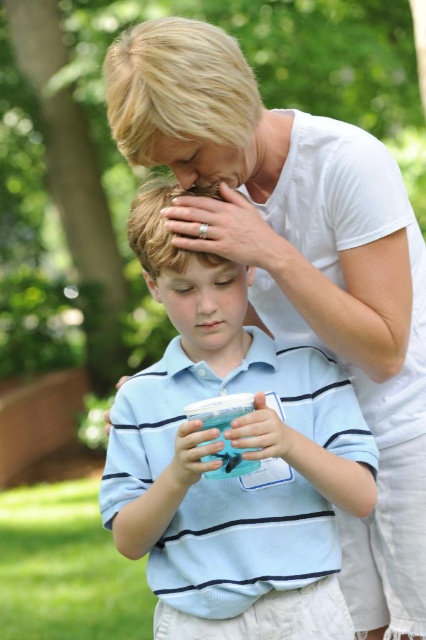
Measure the distance from translucent plastic cup at center to matte plastic cup at lower center.

They are 23.17 inches apart.

Does point (178, 458) come in front of point (123, 378)?

Yes, it is in front of point (123, 378).

Locate an element on the screen. This screenshot has height=640, width=426. translucent plastic cup at center is located at coordinates (192, 454).

The height and width of the screenshot is (640, 426). Identify the location of translucent plastic cup at center. (192, 454).

This screenshot has height=640, width=426. What do you see at coordinates (232, 468) in the screenshot?
I see `blue striped polo shirt at center` at bounding box center [232, 468].

Does blue striped polo shirt at center appear on the right side of matte white hand at upper center?

Incorrect, blue striped polo shirt at center is not on the right side of matte white hand at upper center.

Does point (215, 586) lie behind point (247, 228)?

Yes.

This screenshot has width=426, height=640. Find the location of `blue striped polo shirt at center`. blue striped polo shirt at center is located at coordinates (232, 468).

Between point (256, 547) and point (109, 420), which one is positioned behind?

The point (109, 420) is more distant.

Is blue striped polo shirt at center bigger than matte plastic cup at lower center?

Actually, blue striped polo shirt at center might be smaller than matte plastic cup at lower center.

I want to click on blue striped polo shirt at center, so click(232, 468).

You are a GUI agent. You are given a task and a screenshot of the screen. Output one action in this format:
    pyautogui.click(x=<x>, y=<y>)
    Task: Click on the blue striped polo shirt at center
    This screenshot has height=640, width=426.
    Given the screenshot: What is the action you would take?
    pyautogui.click(x=232, y=468)